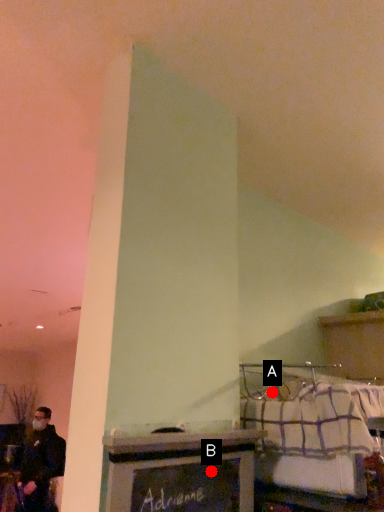
Question: Two points are circled on the image, labeled by A and B beside each circle. Which point appears farthest from the camera in this image?

Choices:
 (A) A is further
 (B) B is further

Answer: (A)